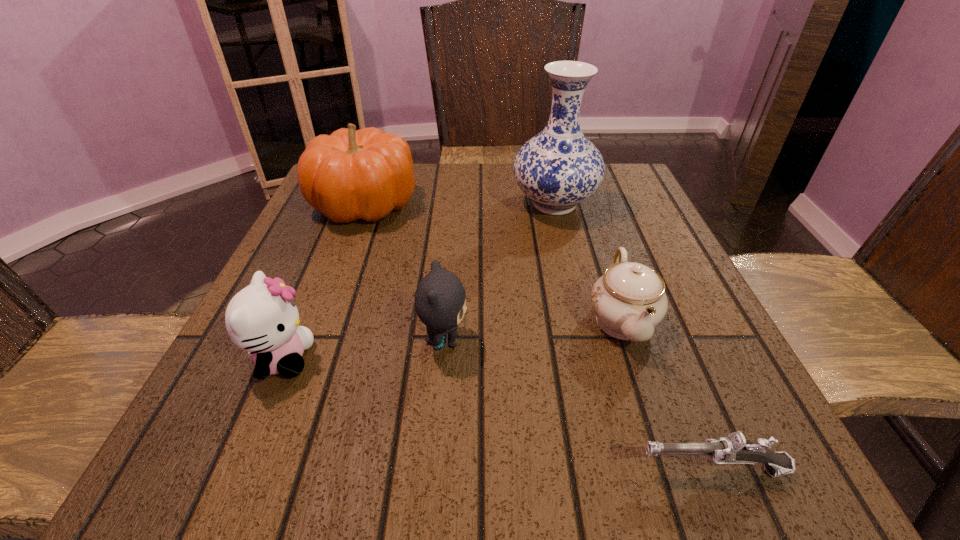
This screenshot has height=540, width=960. Identify the location of vacant area located 0.160m on the front-facing side of the fourth object from right to left. (566, 341).

Locate an element on the screen. The image size is (960, 540). vacant space located at the spout of the chinaware is located at coordinates (664, 447).

You are a GUI agent. You are given a task and a screenshot of the screen. Output one action in this format:
    pyautogui.click(x=<x>, y=<y>)
    Task: Click on the vacant region located 0.120m aimed along the barrel of the gun
    
    Given the screenshot: What is the action you would take?
    pyautogui.click(x=543, y=469)

Find the location of a particular element. The width and height of the screenshot is (960, 540). free space located aimed along the barrel of the gun is located at coordinates (543, 469).

Locate an element on the screen. vacant space located aimed along the barrel of the gun is located at coordinates (512, 469).

Where is `vase present at the far edge`? The image size is (960, 540). vase present at the far edge is located at coordinates (557, 169).

I want to click on pumpkin that is at the far edge, so click(x=351, y=174).

The image size is (960, 540). In order to click on object that is at the near edge in this screenshot , I will do `click(734, 449)`.

The height and width of the screenshot is (540, 960). What are the coordinates of `pumpkin present at the left edge` in the screenshot? It's located at (351, 174).

Image resolution: width=960 pixels, height=540 pixels. Identify the location of kitten at the left edge. (262, 318).